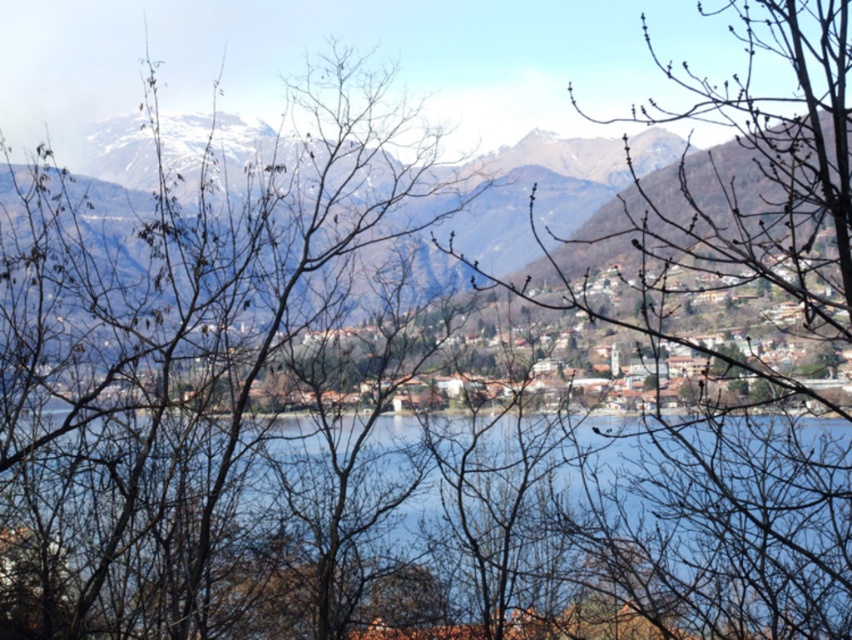
You are standing at the lakeside and want to estimate how far the blue water at center is from you. Based on the scene, can you determine the distance?

The blue water at center is 558.65 feet away from the camera, so the distance from you to the blue water at center is approximately 558.65 feet.

Looking at this image, you are a photographer standing at the edge of the lake in the scenic town. You notice two points marked in the image. Which point, point (804, 563) or point (553, 205), is closer to your current position?

Point (804, 563) is closer to the camera than point (553, 205), so it is closer to your current position.

You are a visitor standing at the lakeside and want to take a photo that includes both the blue water at center and the snowy rocky mountain at center. Based on their positions, where should you position yourself to capture both elements in the frame?

To capture both the blue water at center and the snowy rocky mountain at center in your photo, position yourself so that the blue water at center is below the snowy rocky mountain at center, as the blue water at center is located below the snowy rocky mountain at center in the scene.